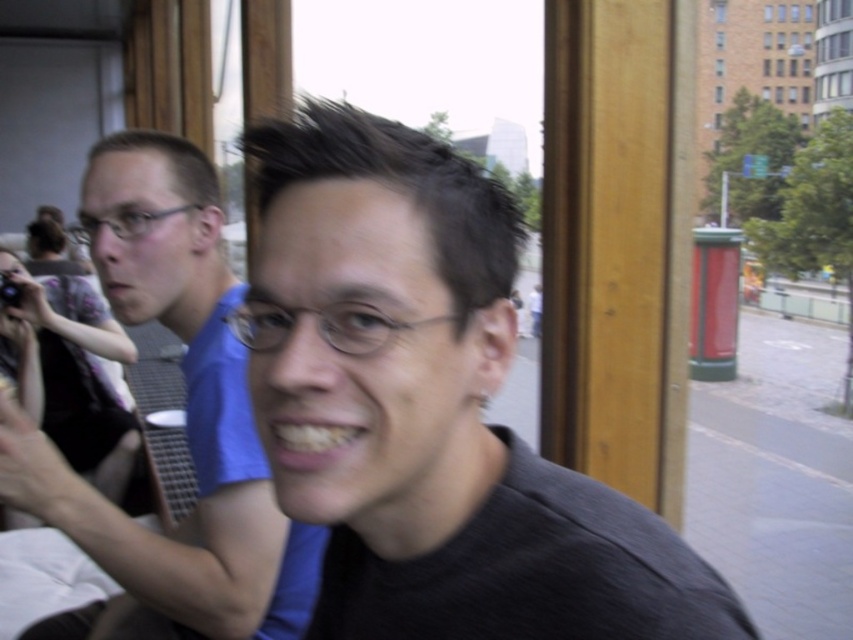
Between blue fabric shirt at left and matte black camera at left, which one has more height?

With more height is matte black camera at left.

Is blue fabric shirt at left above matte black camera at left?

No, blue fabric shirt at left is not above matte black camera at left.

Is point (183, 525) less distant than point (44, 356)?

Yes, point (183, 525) is in front of point (44, 356).

I want to click on blue fabric shirt at left, so click(x=186, y=422).

Is matte black shirt at center taller than matte black camera at left?

No.

Find the location of a particular element. This screenshot has height=640, width=853. matte black shirt at center is located at coordinates (428, 408).

You are a GUI agent. You are given a task and a screenshot of the screen. Output one action in this format:
    pyautogui.click(x=<x>, y=<y>)
    Task: Click on the matte black shirt at center
    Image resolution: width=853 pixels, height=640 pixels.
    Given the screenshot: What is the action you would take?
    pyautogui.click(x=428, y=408)

Is point (480, 532) closer to camera compared to point (212, 480)?

Yes.

From the picture: Can you confirm if matte black shirt at center is positioned above blue fabric shirt at left?

No.

Does point (293, 244) come closer to viewer compared to point (12, 413)?

Yes, it is.

Where is `matte black shirt at center`? This screenshot has width=853, height=640. matte black shirt at center is located at coordinates 428,408.